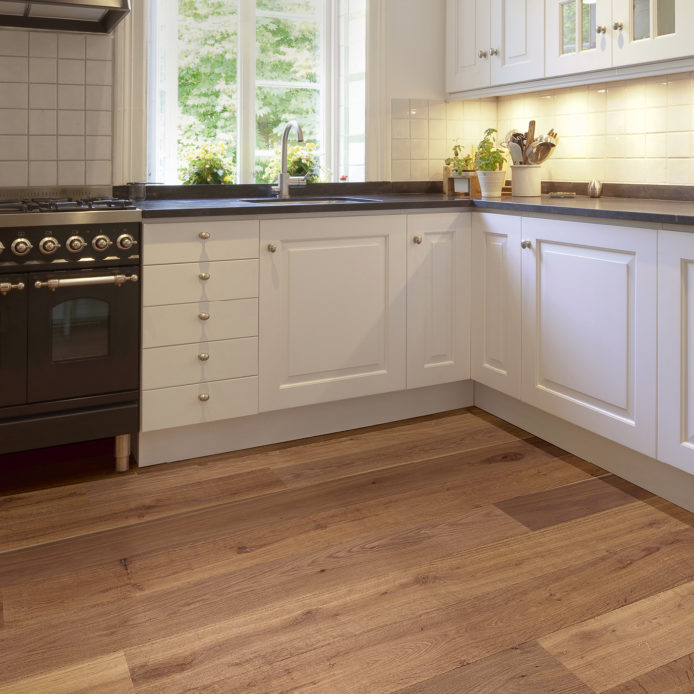
Find the location of a particular element. Image resolution: width=694 pixels, height=694 pixels. open window is located at coordinates (171, 94).